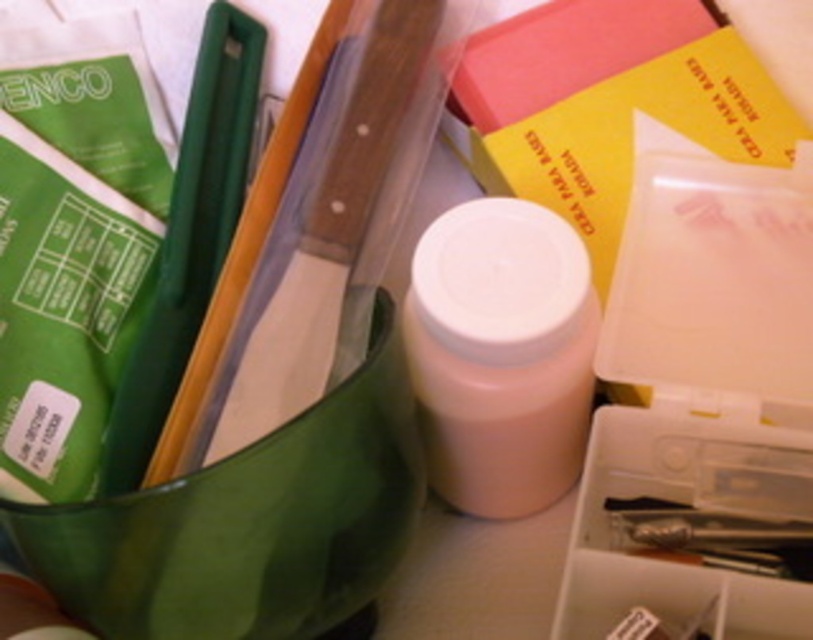
Question: Which point is farther from the camera taking this photo?

Choices:
 (A) (674, 269)
 (B) (500, 419)

Answer: (A)

Question: Which point is farther to the camera?

Choices:
 (A) white plastic container at center-right
 (B) white matte bottle at center

Answer: (A)

Question: Is white plastic container at center-right above white matte bottle at center?

Choices:
 (A) yes
 (B) no

Answer: (B)

Question: From the image, what is the correct spatial relationship of white plastic container at center-right in relation to white matte bottle at center?

Choices:
 (A) right
 (B) left

Answer: (A)

Question: Is white plastic container at center-right bigger than white matte bottle at center?

Choices:
 (A) no
 (B) yes

Answer: (B)